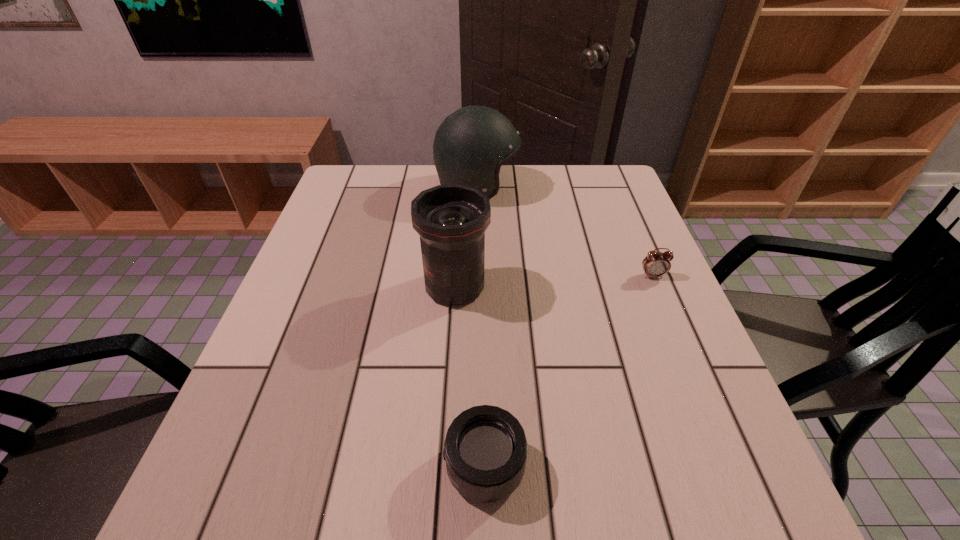
Locate an element on the screen. The width and height of the screenshot is (960, 540). the farthest object is located at coordinates (470, 146).

Identify the location of the farther telephoto lens. (451, 220).

Where is `alarm clock`? Image resolution: width=960 pixels, height=540 pixels. alarm clock is located at coordinates (656, 264).

Identify the location of the shorter telephoto lens. The image size is (960, 540). (485, 449).

Find the location of `the nearest object`. the nearest object is located at coordinates [x=485, y=449].

Where is `free space located 0.150m at the face opening of the farthest object`? This screenshot has height=540, width=960. free space located 0.150m at the face opening of the farthest object is located at coordinates (569, 187).

The image size is (960, 540). I want to click on blank space located on the right of the taller telephoto lens, so [612, 287].

Identify the location of vacant space located on the face of the alarm clock. (702, 393).

At what (x,y) coordinates should I click in order to perform the action: click on free location located 0.180m on the side of the shorter telephoto lens with brand markings and control switches. Please return your answer as a coordinate pair (x, y). Looking at the image, I should click on (331, 467).

Where is `blank space located on the side of the shorter telephoto lens with brand markings and control switches`? The image size is (960, 540). blank space located on the side of the shorter telephoto lens with brand markings and control switches is located at coordinates [231, 467].